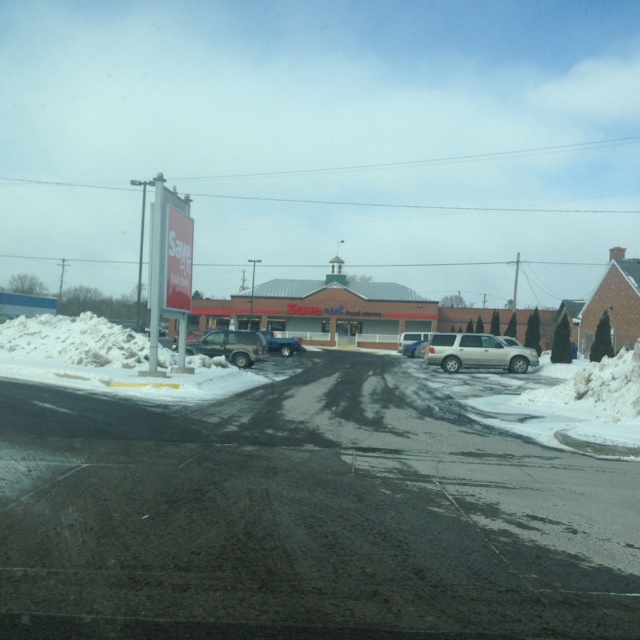
Can you confirm if silver metallic suv at center is thinner than blue matte truck at center?

Incorrect, silver metallic suv at center's width is not less than blue matte truck at center's.

Does silver metallic suv at center lie in front of blue matte truck at center?

Yes, it is.

At what (x,y) coordinates should I click in order to perform the action: click on silver metallic suv at center. Please return your answer as a coordinate pair (x, y). The width and height of the screenshot is (640, 640). Looking at the image, I should click on (228, 346).

Consider the image. Does silver metallic suv at center-right appear on the left side of blue matte truck at center?

No, silver metallic suv at center-right is not to the left of blue matte truck at center.

Does silver metallic suv at center-right appear on the right side of blue matte truck at center?

Correct, you'll find silver metallic suv at center-right to the right of blue matte truck at center.

Where is `silver metallic suv at center-right`? The image size is (640, 640). silver metallic suv at center-right is located at coordinates (476, 353).

Identify the location of silver metallic suv at center-right. This screenshot has height=640, width=640. (476, 353).

Which is more to the right, silver metallic suv at center or satin silver suv at center?

satin silver suv at center

Is point (262, 355) positioned behind point (403, 353)?

That is False.

Identify the location of silver metallic suv at center. The image size is (640, 640). (228, 346).